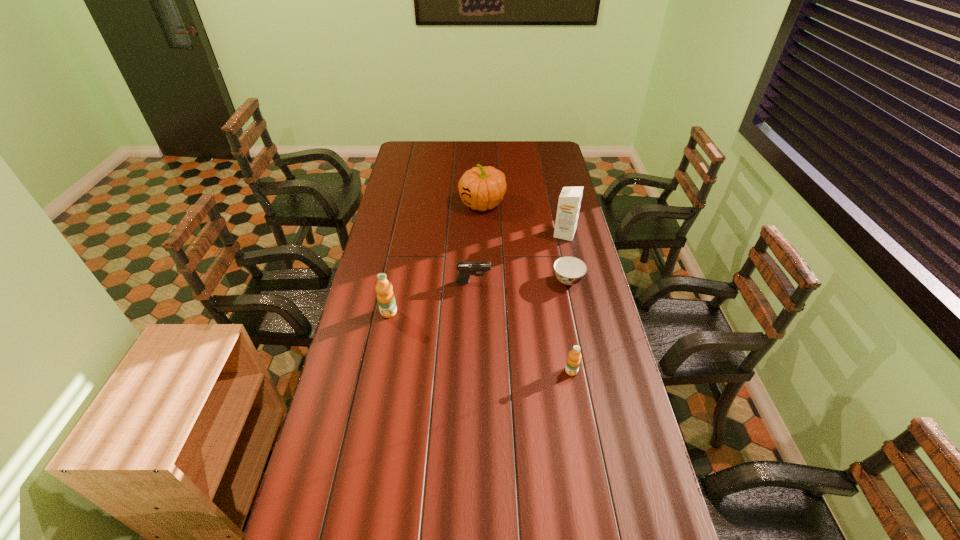
Please point a spot to place another orange_juice for symmetrical spacing. Please provide its 2D coordinates. Your answer should be formatted as a tuple, i.e. [(x, y)], where the tuple contains the x and y coordinates of a point satisfying the conditions above.

[(474, 340)]